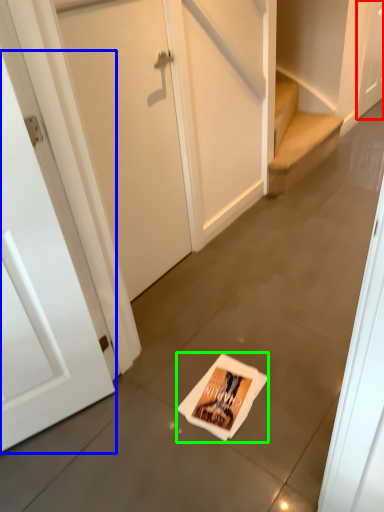
Question: Which object is the farthest from door (highlighted by a red box)? Choose among these: door (highlighted by a blue box) or flyer (highlighted by a green box).

Choices:
 (A) door
 (B) flyer

Answer: (A)